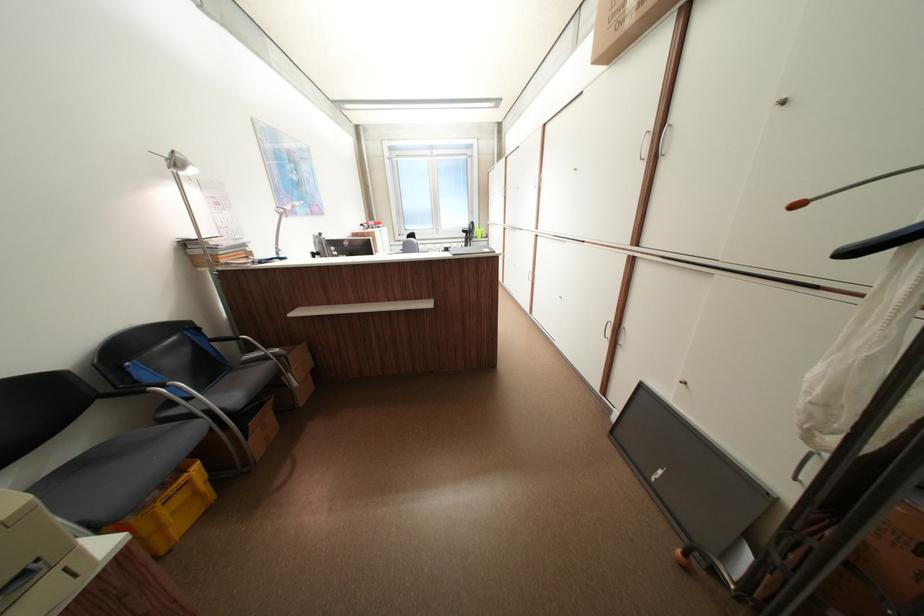
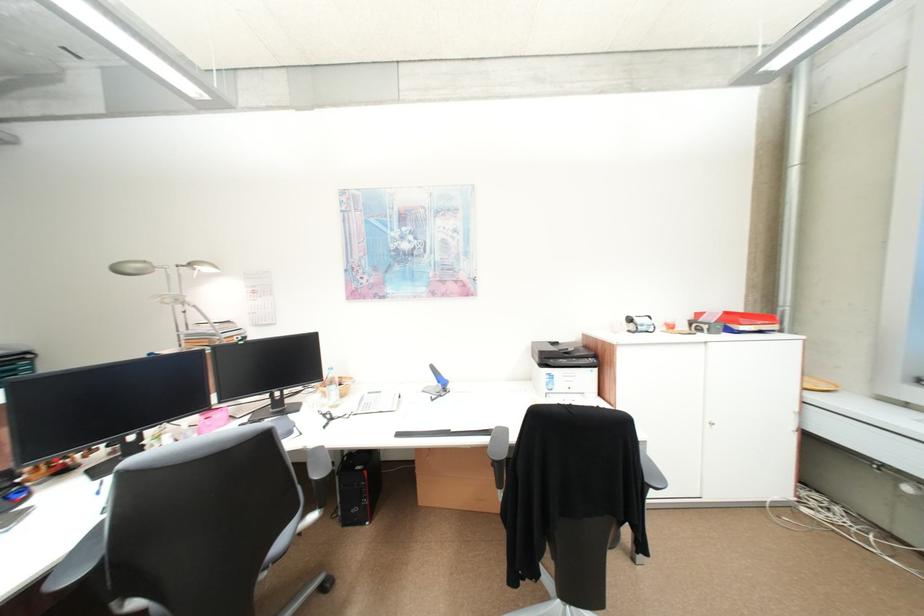
Question: I am providing you with two images of the same scene from different viewpoints. Please identify which objects are invisible in image2.

Choices:
 (A) cardboard box
 (B) silver electric kettle
 (C) silver desk lamp head
 (D) printer scanner lid

Answer: (A)